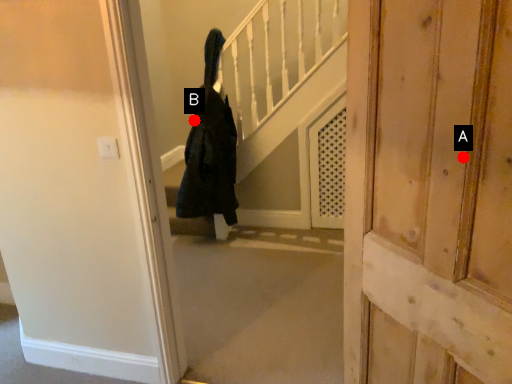
Question: Two points are circled on the image, labeled by A and B beside each circle. Which of the following is the closest to the observer?

Choices:
 (A) A is closer
 (B) B is closer

Answer: (A)